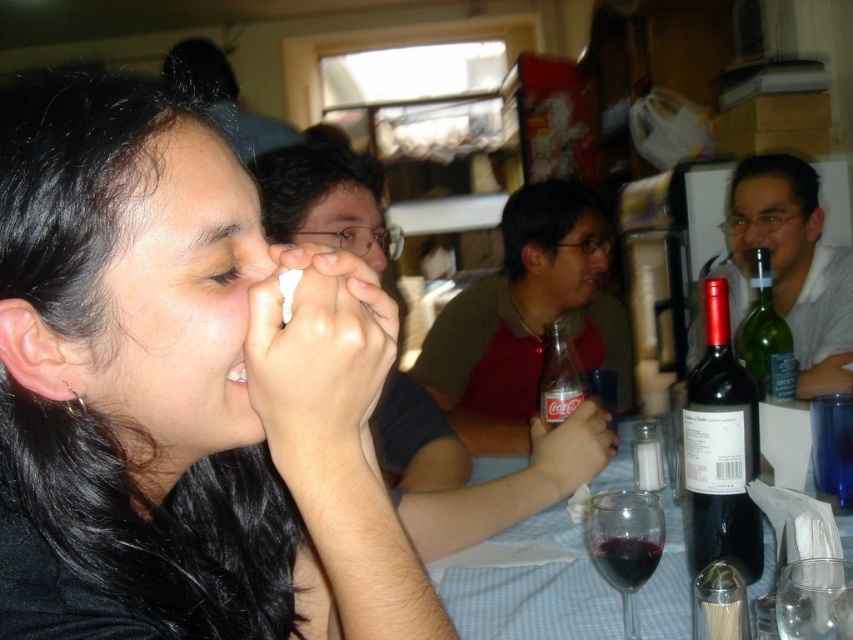
You are a guest at the gathering and want to place a small gift on the table. The gift requires a stable surface area of at least 15 cm by 15 cm. Considering the green glass bottle at right, is there enough space to place the gift on the table without it being too close to the bottle?

The green glass bottle at right is positioned at point (766, 339). Without knowing the exact dimensions of the table or the placement of other objects, it is impossible to determine if there is sufficient space for the gift. Please check the table layout for available space away from the bottle.

You are a photographer at the event and want to capture a photo of the black matte hair at upper left and the black matte wine bottle at right. Which object should you focus on first if you want to ensure both are in focus without adjusting the camera settings?

The black matte hair at upper left is taller than the black matte wine bottle at right, so focusing on the taller object first would help ensure both are in focus.

You are a guest at this gathering and want to pour yourself a drink. The green glass bottle at right contains water, while the transparent glass of red wine at lower center is half full. Which container should you choose if you want to refill your glass without spilling?

The green glass bottle at right is much taller than the transparent glass of red wine at lower center, so it is more likely to be stable and less prone to tipping over when pouring, making it a safer choice to avoid spills.